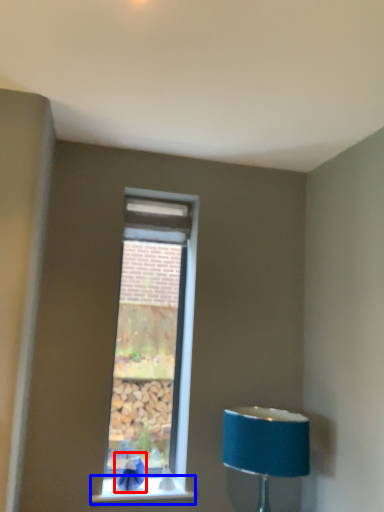
Question: Which of the following is the farthest to the observer, swivel chair (highlighted by a red box) or window sill (highlighted by a blue box)?

Choices:
 (A) swivel chair
 (B) window sill

Answer: (A)